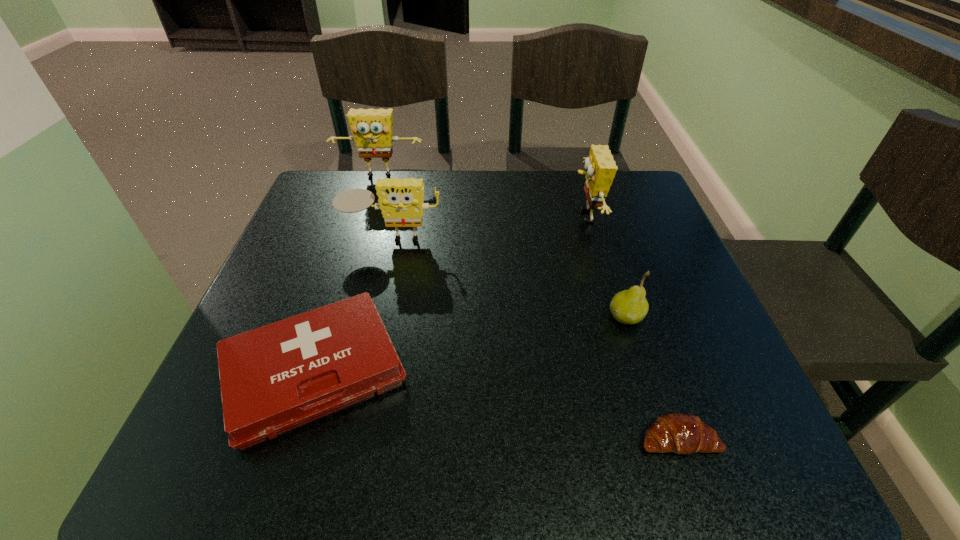
Identify the location of the farthest object. The width and height of the screenshot is (960, 540). (372, 129).

Find the location of a particular element. This screenshot has height=540, width=960. the rightmost sponge is located at coordinates (600, 166).

At what (x,y) coordinates should I click in order to perform the action: click on pear. Please return your answer as a coordinate pair (x, y). The height and width of the screenshot is (540, 960). Looking at the image, I should click on (630, 306).

Locate an element on the screen. the fifth tallest object is located at coordinates (274, 378).

Locate an element on the screen. crescent roll is located at coordinates (680, 433).

This screenshot has height=540, width=960. I want to click on free space located 0.270m on the face of the farthest object, so click(357, 249).

Find the location of `free space located 0.100m on the face of the rightmost sponge`. free space located 0.100m on the face of the rightmost sponge is located at coordinates (529, 217).

Where is `vacant space located 0.360m on the face of the rightmost sponge`? The width and height of the screenshot is (960, 540). vacant space located 0.360m on the face of the rightmost sponge is located at coordinates (423, 217).

Identify the location of free space located on the face of the rightmost sponge. (464, 217).

The image size is (960, 540). I want to click on vacant region located 0.190m on the back of the fourth tallest object, so click(603, 242).